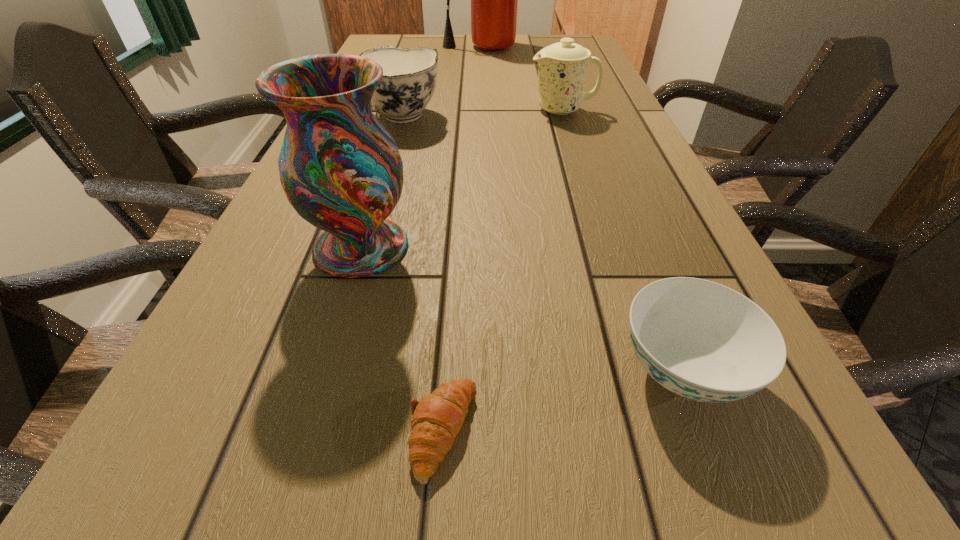
The height and width of the screenshot is (540, 960). I want to click on free area in between the vase and the tallest chinaware, so click(462, 179).

Find the location of a particular element. empty location between the shortest chinaware and the second tallest object is located at coordinates (521, 309).

Where is `blank region between the third tallest object and the second tallest object`? Image resolution: width=960 pixels, height=540 pixels. blank region between the third tallest object and the second tallest object is located at coordinates coord(462,179).

Where is `vacant area that lies between the third nearest object and the shortest object`? The height and width of the screenshot is (540, 960). vacant area that lies between the third nearest object and the shortest object is located at coordinates (402, 339).

Where is `vacant space that is in between the shortest chinaware and the fourth farthest object`? This screenshot has height=540, width=960. vacant space that is in between the shortest chinaware and the fourth farthest object is located at coordinates (521, 309).

You are a GUI agent. You are given a task and a screenshot of the screen. Output one action in this format:
    pyautogui.click(x=<x>, y=<y>)
    Task: Click on the second closest object to the fourth shortest object
    Image resolution: width=960 pixels, height=540 pixels.
    Given the screenshot: What is the action you would take?
    pyautogui.click(x=494, y=0)

Identify which object is the third nearest to the fifth tallest object. Please provide its 2D coordinates. Your answer should be formatted as a tuple, i.e. [(x, y)], where the tuple contains the x and y coordinates of a point satisfying the conditions above.

[(409, 75)]

The image size is (960, 540). I want to click on chinaware that is the second closest to the nearest chinaware, so click(x=562, y=66).

At what (x,y) coordinates should I click in order to perform the action: click on chinaware that stands as the second closest to the second shortest object. Please return your answer as a coordinate pair (x, y). This screenshot has height=540, width=960. Looking at the image, I should click on [562, 66].

At what (x,y) coordinates should I click in order to perform the action: click on free point that satisfies the following two spatial constraints: 1. on the instruction side of the shortest chinaware; 2. on the right side of the fire extinguisher. Please return your answer as a coordinate pair (x, y). The image size is (960, 540). Looking at the image, I should click on (486, 371).